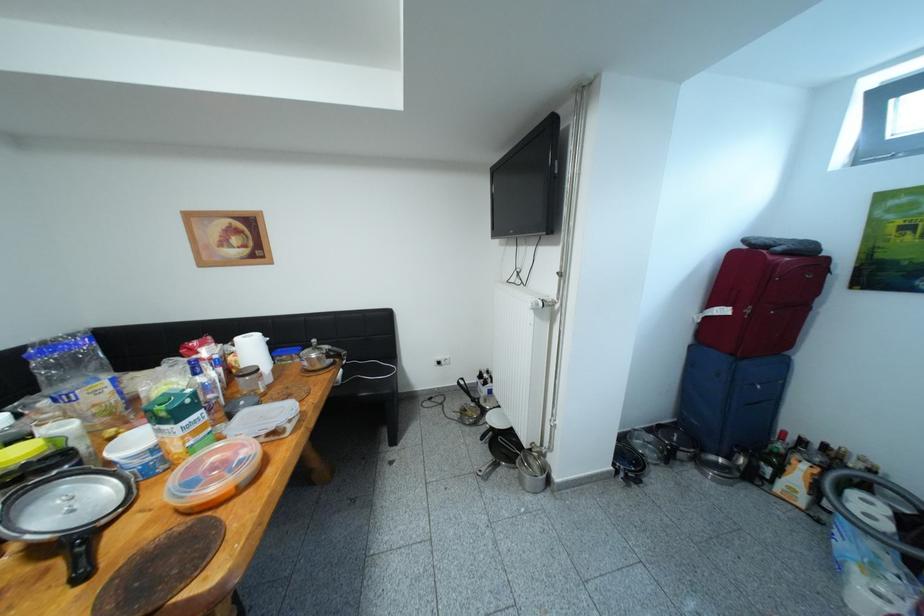
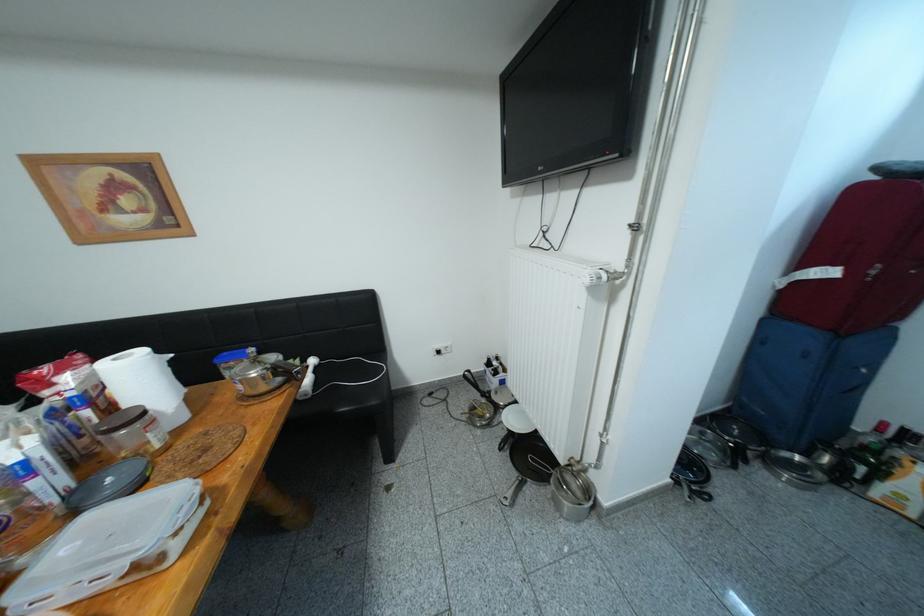
Question: In a continuous first-person perspective shot, in which direction is the camera moving?

Choices:
 (A) Left
 (B) Right
 (C) Forward
 (D) Backward

Answer: (C)